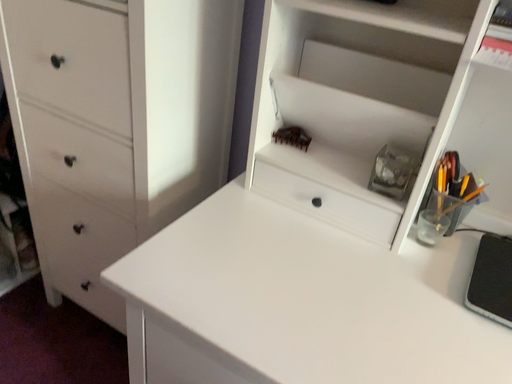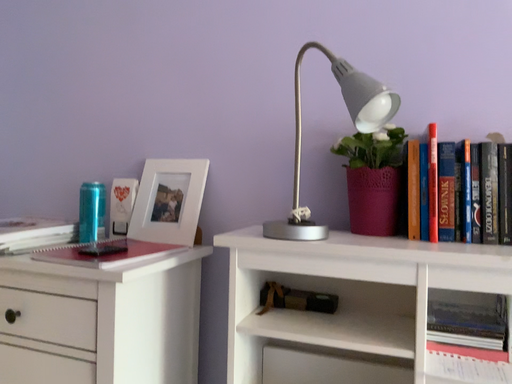
Question: How did the camera likely rotate when shooting the video?

Choices:
 (A) rotated downward
 (B) rotated upward

Answer: (B)